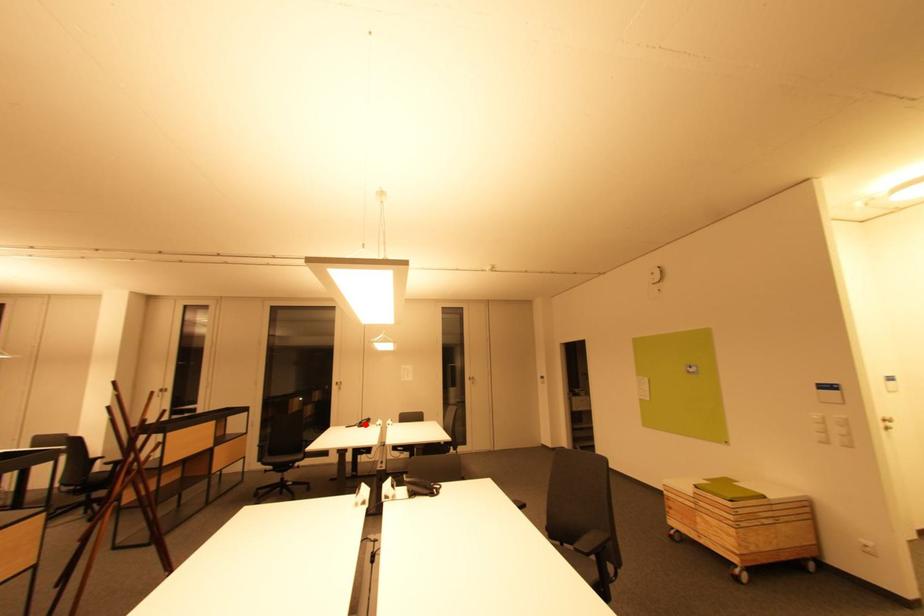
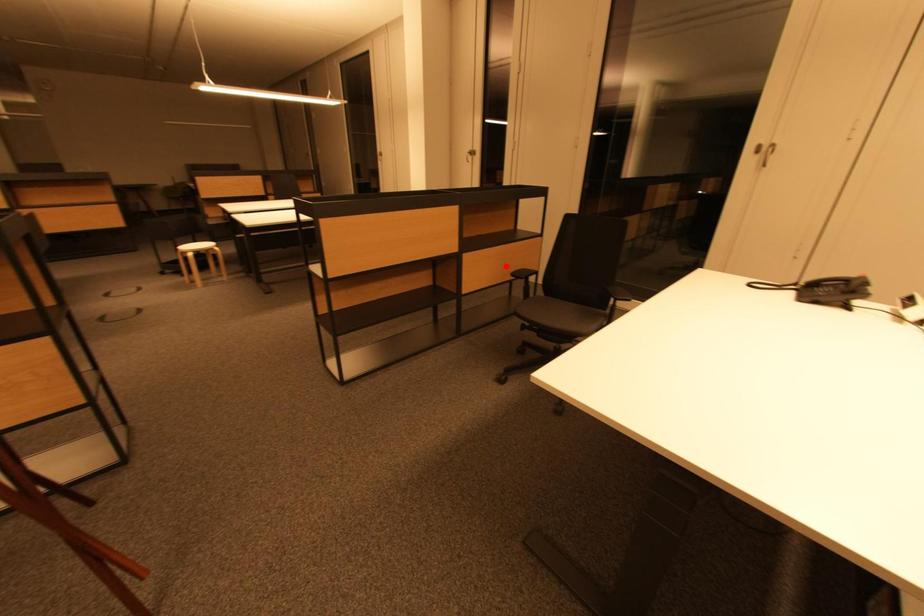
I am providing you with two images of the same scene from different viewpoints. A red point is marked on the first image and another point is marked on the second image. Do the highlighted points in image1 and image2 indicate the same real-world spot?

No